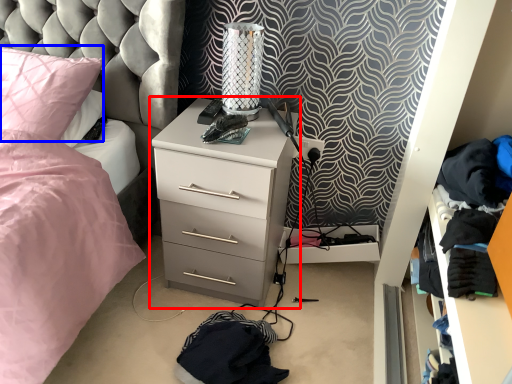
Question: Which object appears farthest to the camera in this image, chest of drawers (highlighted by a red box) or pillow (highlighted by a blue box)?

Choices:
 (A) chest of drawers
 (B) pillow

Answer: (B)